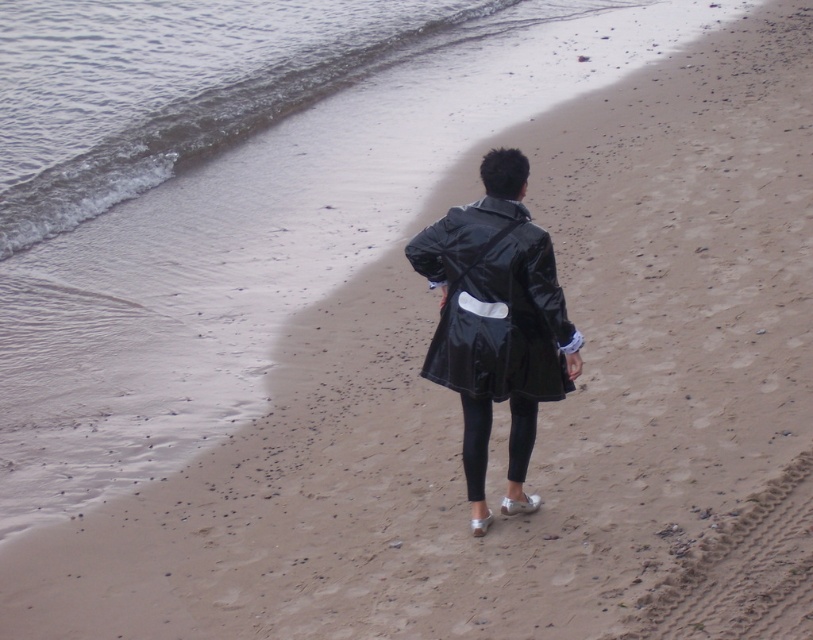
Is glossy water at upper left positioned at the back of glossy black coat at center?

Yes, it is.

Can you confirm if glossy water at upper left is smaller than glossy black coat at center?

Actually, glossy water at upper left might be larger than glossy black coat at center.

Does point (31, 97) come in front of point (564, 346)?

No.

Identify the location of glossy water at upper left. (190, 84).